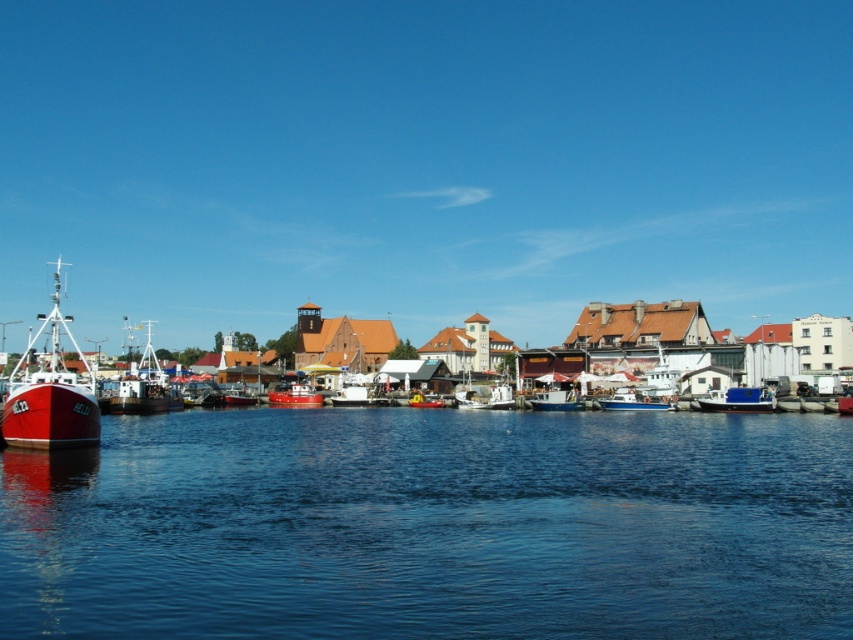
You are standing at the point marked by coordinates (432, 525) in the harbor scene. What is the closest object to you?

The closest object to the point marked by coordinates (432, 525) is the blue liquid water at lower center.